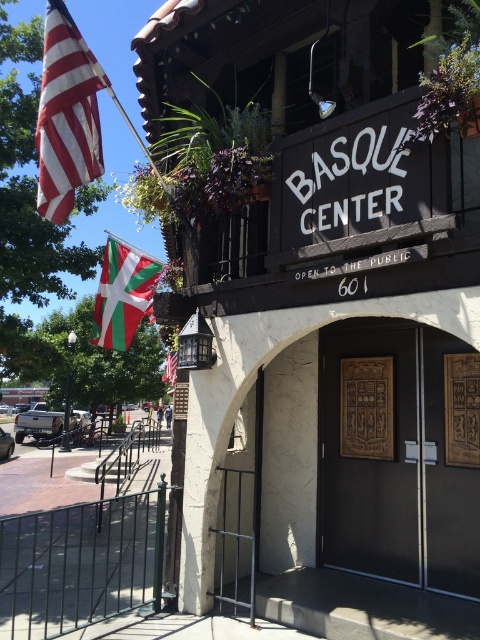
Question: Which of the following is the closest to the observer?

Choices:
 (A) (169, 22)
 (B) (169, 380)
 (C) (152, 260)
 (D) (96, 170)

Answer: (D)

Question: Is wooden door at center wider than green and white fabric flag at left?

Choices:
 (A) yes
 (B) no

Answer: (B)

Question: Which object is closer to the camera taking this photo?

Choices:
 (A) wooden sign at upper center
 (B) green and white fabric flag at left
 (C) wooden door at center
 (D) red-white striped flag at upper left

Answer: (A)

Question: Does wooden sign at upper center come behind green and white fabric flag at left?

Choices:
 (A) no
 (B) yes

Answer: (A)

Question: Can you confirm if red-white striped flag at upper left is thinner than green and white fabric flag at left?

Choices:
 (A) yes
 (B) no

Answer: (A)

Question: Which object is closer to the camera taking this photo?

Choices:
 (A) greenmaterial/textureflag at left
 (B) wooden sign at upper center
 (C) wooden door at center

Answer: (B)